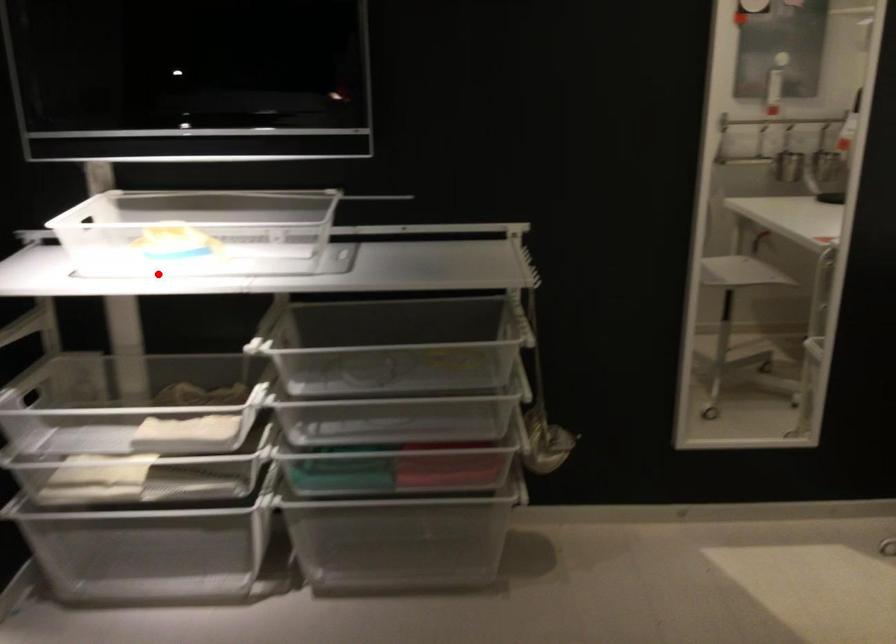
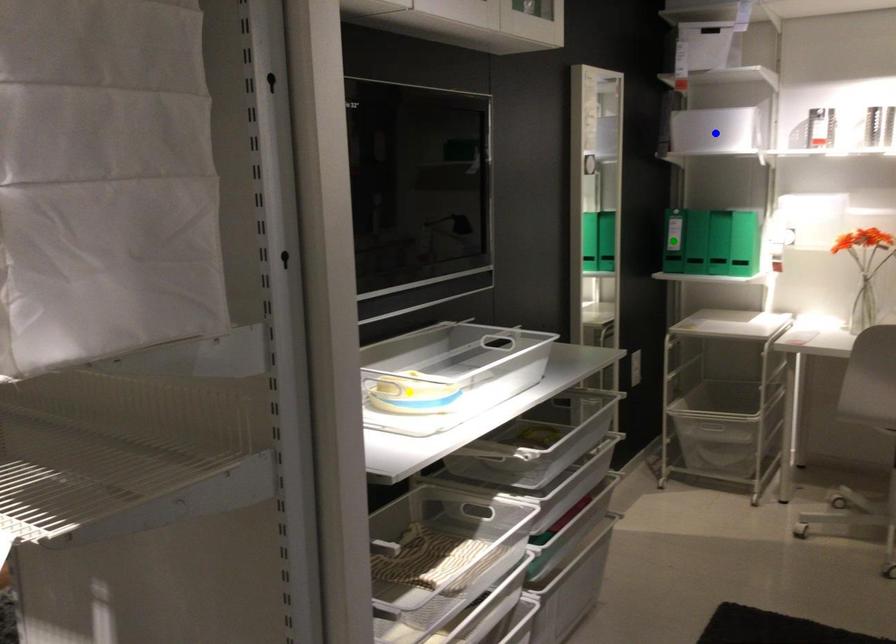
Question: I am providing you with two images of the same scene from different viewpoints. A red point is marked on the first image. You are given multiple points on the second image. Which spot in image 2 lines up with the point in image 1?

Choices:
 (A) blue point
 (B) yellow point
 (C) green point

Answer: (B)